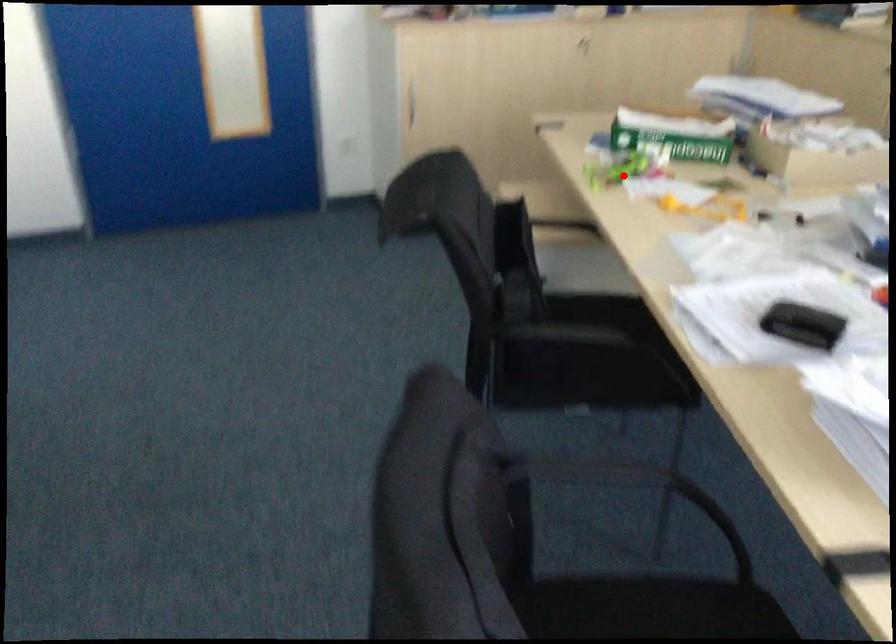
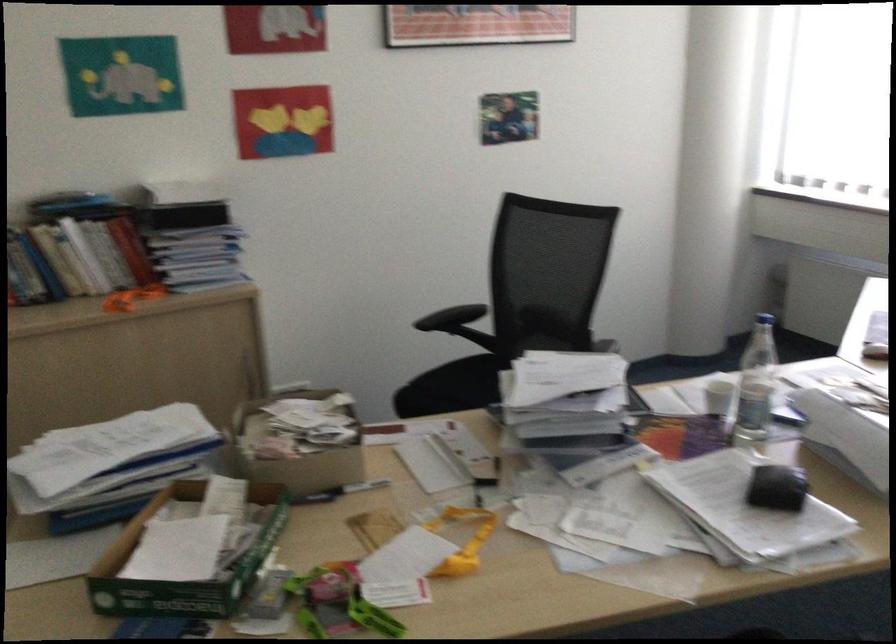
Question: I am providing you with two images of the same scene from different viewpoints. Image1 has a red point marked. In image2, the corresponding 3D location appears at what relative position? Reply with the corresponding letter.

Choices:
 (A) Closer
 (B) Farther

Answer: (A)